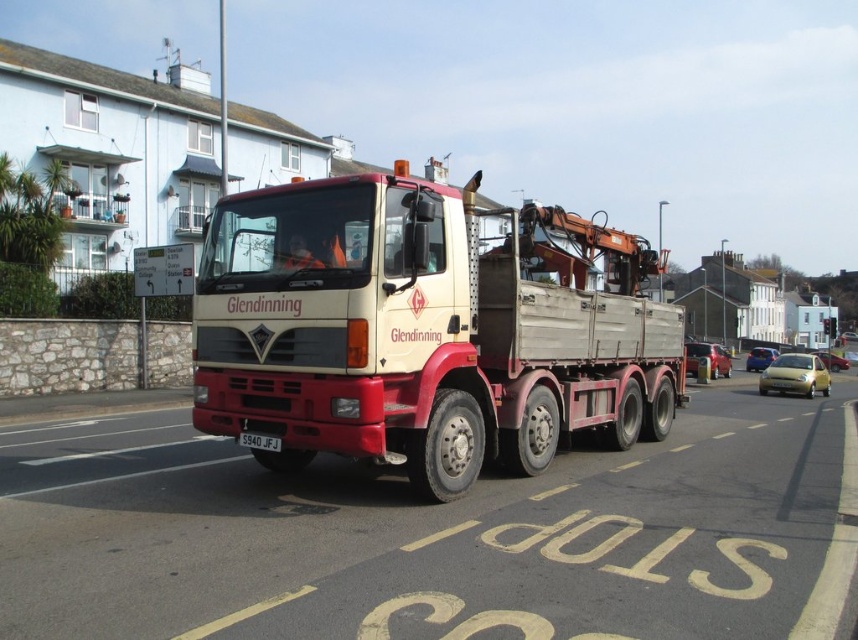
Which is in front, point (775, 388) or point (275, 438)?

Point (275, 438) is more forward.

Consider the image. Does metallic gold taxi at right have a greater height compared to white plastic license plate at center?

Yes.

Measure the distance between point (780, 369) and camera.

Point (780, 369) is 26.28 meters from camera.

Find the location of `metallic gold taxi at right`. metallic gold taxi at right is located at coordinates (795, 376).

Is matte white truck at center behind metallic gold taxi at right?

That is False.

Who is more forward, (645, 310) or (804, 390)?

Point (645, 310)

The height and width of the screenshot is (640, 858). Identify the location of matte white truck at center. (423, 330).

Where is `matte white truck at center`? This screenshot has height=640, width=858. matte white truck at center is located at coordinates (423, 330).

Is matte white truck at center further to camera compared to white plastic license plate at center?

No, matte white truck at center is in front of white plastic license plate at center.

What do you see at coordinates (423, 330) in the screenshot? The width and height of the screenshot is (858, 640). I see `matte white truck at center` at bounding box center [423, 330].

Locate an element on the screen. matte white truck at center is located at coordinates (423, 330).